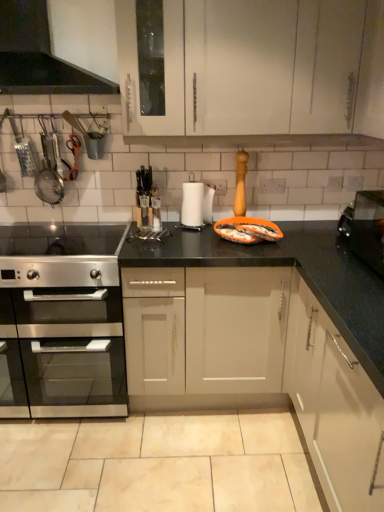
Identify the location of vacant point above beige matte granite at lower center (from a real-world perspective). (155, 448).